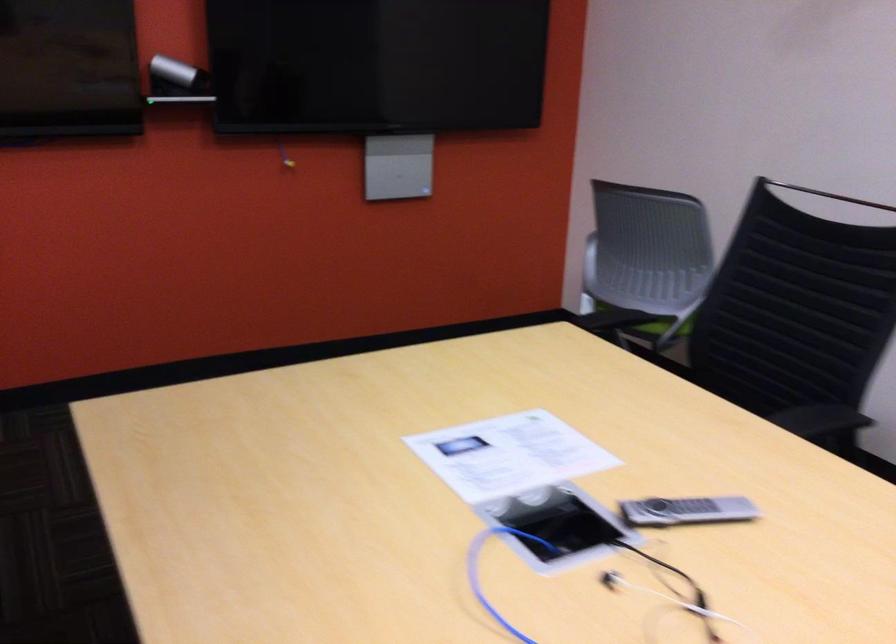
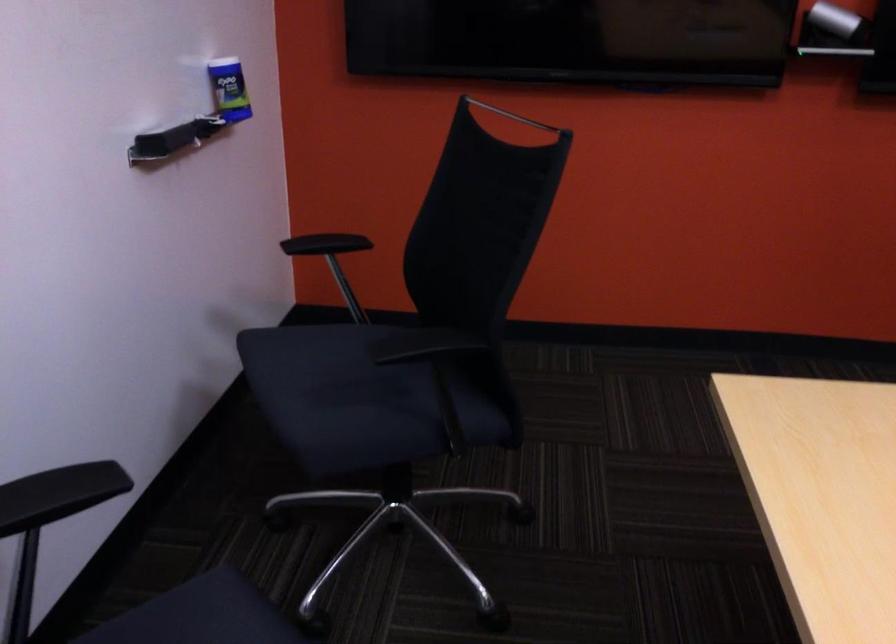
Question: Based on the continuous images, in which direction is the camera rotating? Reply with the corresponding letter.

Choices:
 (A) Left
 (B) Right
 (C) Up
 (D) Down

Answer: (A)